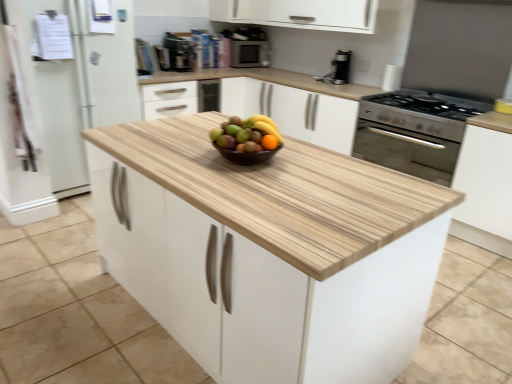
Question: Is black plastic coffee machine at upper center shorter than natural wood cabinet at center, which ranks as the first cabinetry in bottom-to-top order?

Choices:
 (A) no
 (B) yes

Answer: (B)

Question: Is black plastic coffee machine at upper center closer to camera compared to natural wood cabinet at center, which is counted as the 3th cabinetry, starting from the back?

Choices:
 (A) yes
 (B) no

Answer: (B)

Question: Would you consider black plastic coffee machine at upper center to be distant from natural wood cabinet at center, marked as the first cabinetry in a front-to-back arrangement?

Choices:
 (A) no
 (B) yes

Answer: (B)

Question: Considering the relative positions of black plastic coffee machine at upper center and natural wood cabinet at center, which ranks as the first cabinetry in bottom-to-top order, in the image provided, is black plastic coffee machine at upper center to the left of natural wood cabinet at center, which ranks as the first cabinetry in bottom-to-top order, from the viewer's perspective?

Choices:
 (A) yes
 (B) no

Answer: (A)

Question: Can you confirm if black plastic coffee machine at upper center is wider than natural wood cabinet at center, which is counted as the 3th cabinetry, starting from the back?

Choices:
 (A) no
 (B) yes

Answer: (A)

Question: From a real-world perspective, is white wood cabinet at upper center, the 1th cabinetry from the top, physically located above or below metallic silver microwave at upper center?

Choices:
 (A) below
 (B) above

Answer: (B)

Question: In terms of height, does white wood cabinet at upper center, which ranks as the 3th cabinetry in bottom-to-top order, look taller or shorter compared to metallic silver microwave at upper center?

Choices:
 (A) short
 (B) tall

Answer: (A)

Question: Looking at the image, does white wood cabinet at upper center, positioned as the first cabinetry in back-to-front order, seem bigger or smaller compared to metallic silver microwave at upper center?

Choices:
 (A) small
 (B) big

Answer: (B)

Question: From the image's perspective, is white wood cabinet at upper center, the 1th cabinetry from the top, above or below metallic silver microwave at upper center?

Choices:
 (A) below
 (B) above

Answer: (B)

Question: Is point (317, 76) closer or farther from the camera than point (229, 147)?

Choices:
 (A) farther
 (B) closer

Answer: (A)

Question: Considering the positions of satin black coffee maker at upper right and orange matte grapefruit at center in the image, is satin black coffee maker at upper right taller or shorter than orange matte grapefruit at center?

Choices:
 (A) tall
 (B) short

Answer: (A)

Question: From the image's perspective, is satin black coffee maker at upper right above or below orange matte grapefruit at center?

Choices:
 (A) below
 (B) above

Answer: (B)

Question: Is satin black coffee maker at upper right inside the boundaries of orange matte grapefruit at center, or outside?

Choices:
 (A) outside
 (B) inside

Answer: (A)

Question: Is point (264, 43) positioned closer to the camera than point (267, 18)?

Choices:
 (A) farther
 (B) closer

Answer: (A)

Question: From the image's perspective, relative to white wood cabinet at upper center, the 1th cabinetry from the top, is metallic silver microwave at upper center above or below?

Choices:
 (A) below
 (B) above

Answer: (A)